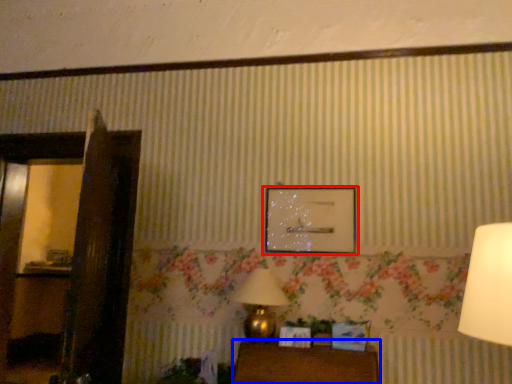
Question: Which object is further to the camera taking this photo, picture frame (highlighted by a red box) or furniture (highlighted by a blue box)?

Choices:
 (A) picture frame
 (B) furniture

Answer: (A)